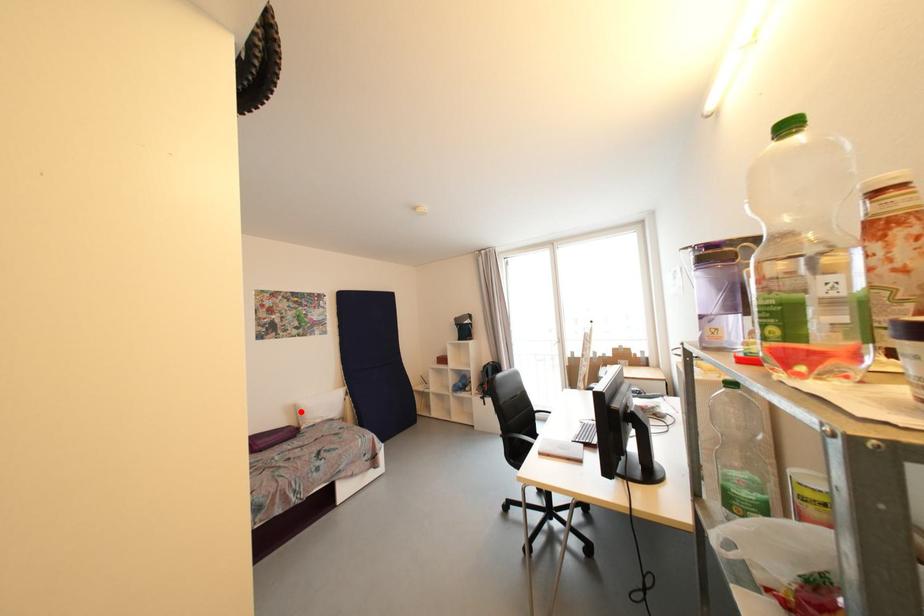
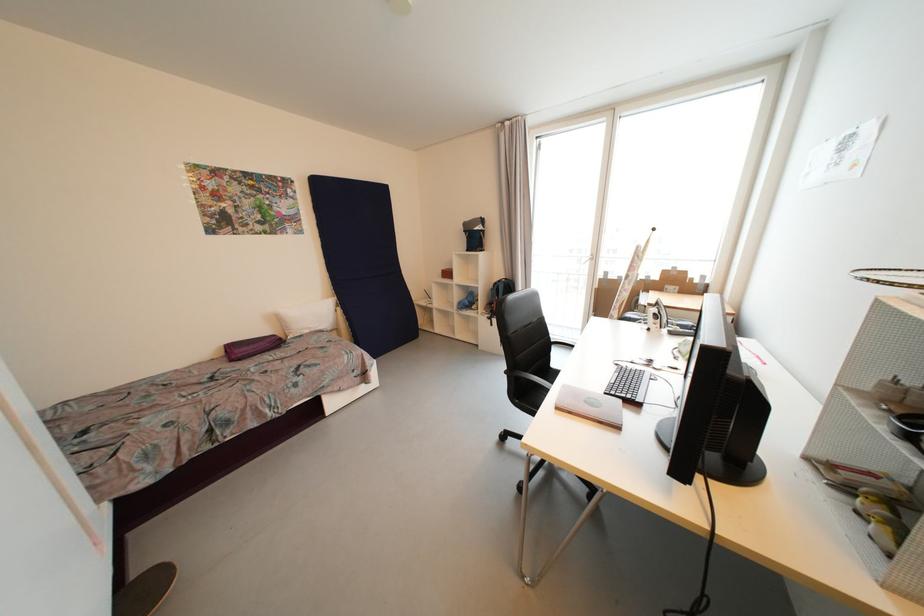
The point at the highlighted location is marked in the first image. Where is the corresponding point in the second image?

(283, 321)